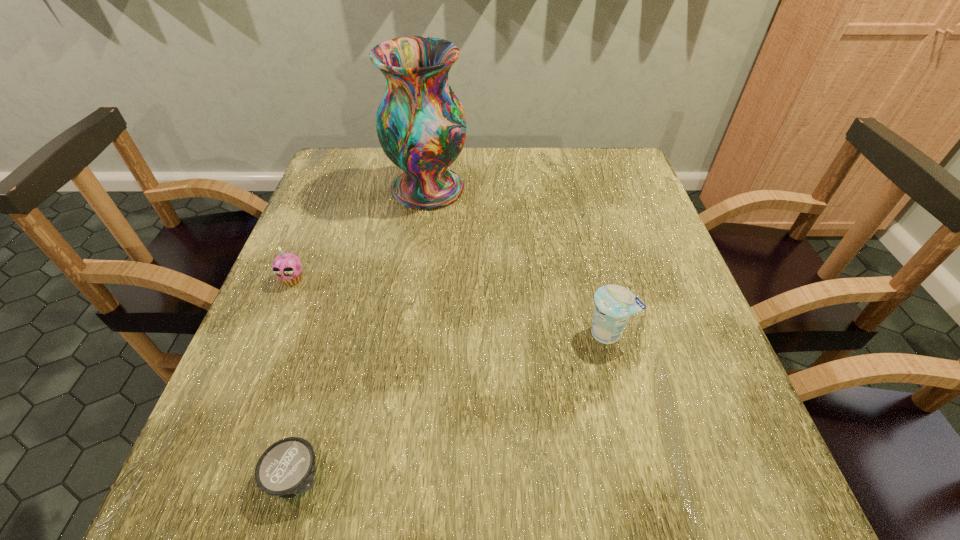
At what (x,y) coordinates should I click in order to perform the action: click on free space at the right edge of the desktop. Please return your answer as a coordinate pair (x, y). This screenshot has height=540, width=960. Looking at the image, I should click on (616, 271).

You are a GUI agent. You are given a task and a screenshot of the screen. Output one action in this format:
    pyautogui.click(x=<x>, y=<y>)
    Task: Click on the vacant area at the far left corner
    Image resolution: width=960 pixels, height=540 pixels.
    Given the screenshot: What is the action you would take?
    pyautogui.click(x=369, y=168)

The height and width of the screenshot is (540, 960). Find the location of `free space at the far right corner of the desktop`. free space at the far right corner of the desktop is located at coordinates (580, 164).

Where is `vacant point located between the cupcake and the nearest object`? vacant point located between the cupcake and the nearest object is located at coordinates (295, 379).

Where is `free space between the farthest object and the nearest object`? free space between the farthest object and the nearest object is located at coordinates (362, 333).

The image size is (960, 540). In order to click on unoccupied position between the nearer yogurt and the right yogurt in this screenshot , I will do `click(452, 406)`.

At what (x,y) coordinates should I click in order to perform the action: click on free space between the second farthest object and the taller yogurt. Please return your answer as a coordinate pair (x, y). Looking at the image, I should click on (450, 306).

Where is `free space between the second nearest object and the leftmost object`? The image size is (960, 540). free space between the second nearest object and the leftmost object is located at coordinates (450, 306).

Where is `free spot between the cupcake and the nearer yogurt`? free spot between the cupcake and the nearer yogurt is located at coordinates pos(295,379).

What are the coordinates of `unoccupied position between the third nearest object and the taller yogurt` in the screenshot? It's located at click(450, 306).